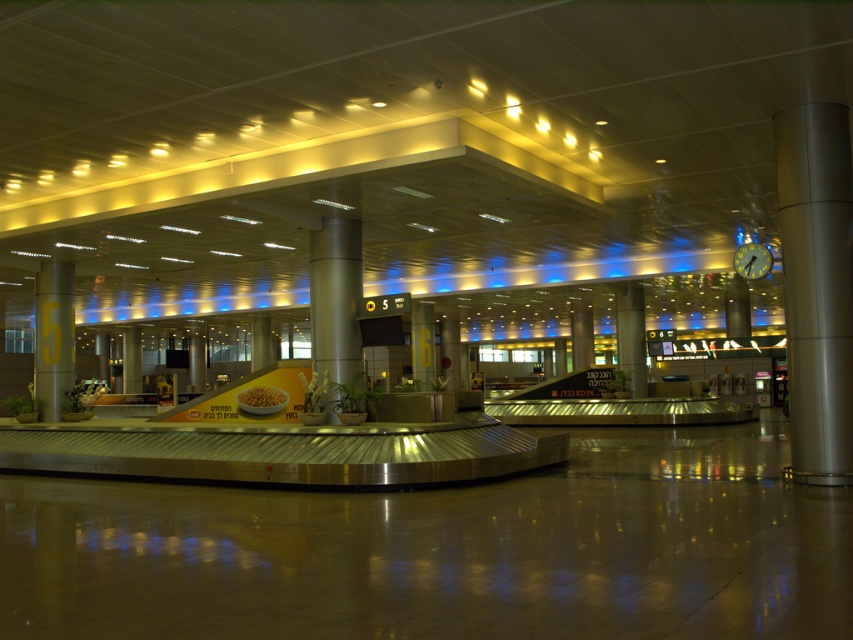
You are standing in the airport baggage claim area. You see a point marked at coordinates [816,285]. What object is located at that point?

The point at coordinates [816,285] indicates a metallic column at right.

You are a maintenance worker needing to place a new sensor on the narrowest object between the satin silver column at center and the green glass clock at upper right. Which object should you choose?

The green glass clock at upper right is narrower than the satin silver column at center, so you should place the sensor on the green glass clock at upper right.